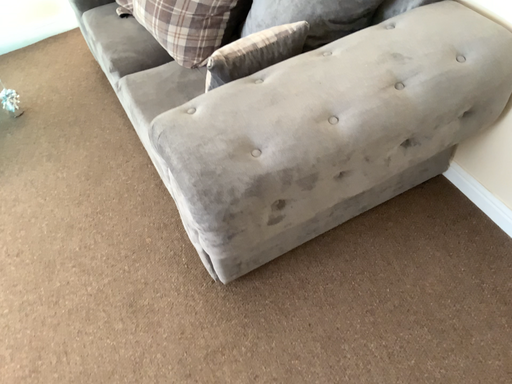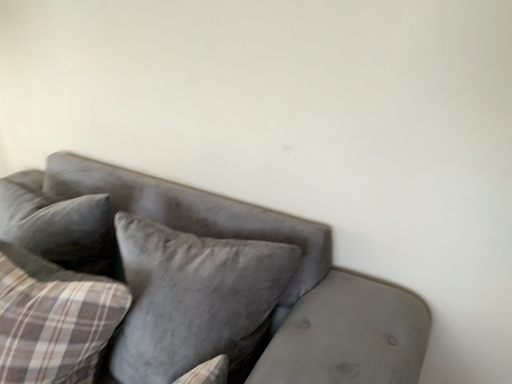
Question: How did the camera likely rotate when shooting the video?

Choices:
 (A) rotated upward
 (B) rotated downward

Answer: (A)